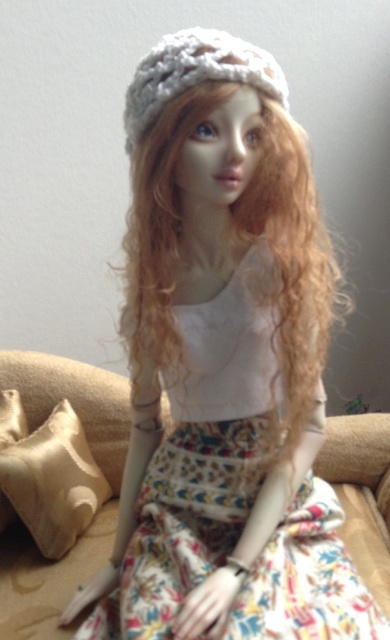
Between point (271, 378) and point (62, 506), which one is positioned in front?

Point (271, 378) is in front.

Find the location of a particular element. The height and width of the screenshot is (640, 390). floral cotton dress at center is located at coordinates (226, 490).

Does curly blonde hair at center have a lesser height compared to white knitted hat at upper center?

No, curly blonde hair at center is not shorter than white knitted hat at upper center.

Who is taller, curly blonde hair at center or white knitted hat at upper center?

With more height is curly blonde hair at center.

Is point (294, 216) less distant than point (253, 64)?

No.

Find the location of `curly blonde hair at center`. curly blonde hair at center is located at coordinates (290, 262).

Can you confirm if floral cotton dress at center is taller than curly blonde hair at center?

Correct, floral cotton dress at center is much taller as curly blonde hair at center.

Is floral cotton dress at center positioned at the back of curly blonde hair at center?

No.

Does point (354, 628) come behind point (285, 227)?

No, (354, 628) is in front of (285, 227).

This screenshot has height=640, width=390. What are the coordinates of `floral cotton dress at center` in the screenshot? It's located at (226, 490).